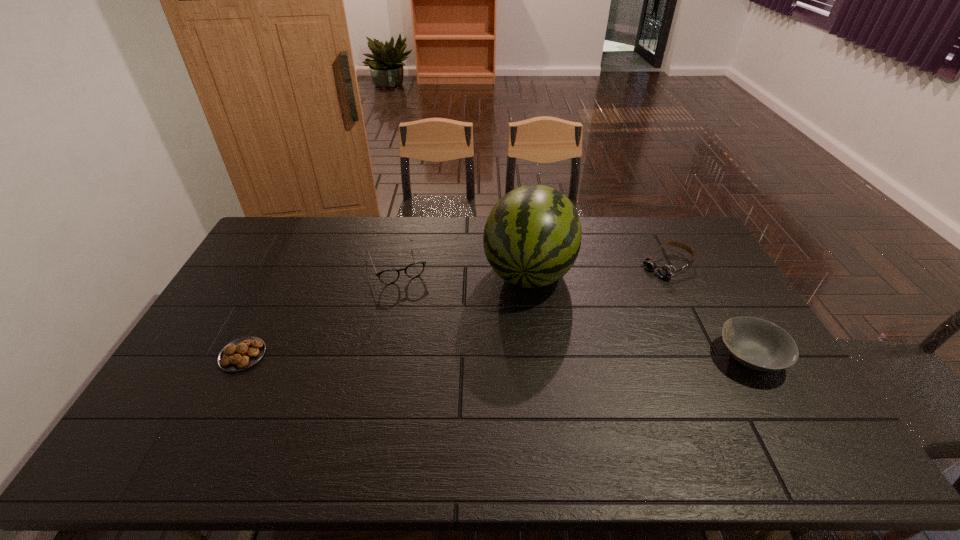
Image resolution: width=960 pixels, height=540 pixels. In order to click on vacant space positioned 0.150m on the front-facing side of the goggles in this screenshot , I will do `click(624, 294)`.

Identify the location of vacant space positioned 0.180m on the front-facing side of the goggles. (618, 298).

I want to click on vacant space located 0.380m at the stem end of the tallest object, so click(x=497, y=411).

Image resolution: width=960 pixels, height=540 pixels. Identify the location of free space located 0.090m at the stem end of the tallest object. (516, 329).

Image resolution: width=960 pixels, height=540 pixels. Identify the location of vacant space situated at the stem end of the tallest object. (507, 370).

Where is `free space located through the lenses of the second object from left to right`? This screenshot has width=960, height=540. free space located through the lenses of the second object from left to right is located at coordinates tap(424, 330).

Locate an element on the screen. vacant space situated 0.090m through the lenses of the second object from left to right is located at coordinates (413, 302).

Find the location of a particular element. vacant area located through the lenses of the second object from left to right is located at coordinates (442, 369).

In order to click on goggles positioned at the far edge in this screenshot , I will do `click(665, 271)`.

Identify the location of watermelon that is at the far edge. (532, 237).